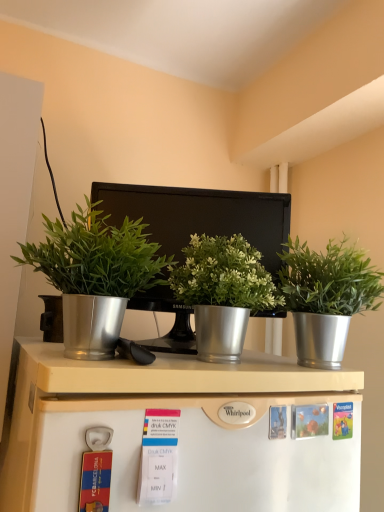
Question: Does point (130, 355) appear closer or farther from the camera than point (182, 305)?

Choices:
 (A) farther
 (B) closer

Answer: (B)

Question: From the image's perspective, relative to metallic silver monitor at center, is metallic silver plant pot at left, positioned as the 1th houseplant in left-to-right order, above or below?

Choices:
 (A) below
 (B) above

Answer: (B)

Question: Estimate the real-world distances between objects in this image. Which object is closer to the silver metallic plant pot at center, which is the 3th houseplant in left-to-right order?

Choices:
 (A) metallic silver pot at center, the second houseplant in the right-to-left sequence
 (B) metallic silver plant pot at left, positioned as the third houseplant in right-to-left order
 (C) white matte refrigerator at lower center
 (D) metallic silver monitor at center

Answer: (A)

Question: Which is farther from the metallic silver pot at center, which is the 2th houseplant from left to right?

Choices:
 (A) metallic silver plant pot at left, positioned as the third houseplant in right-to-left order
 (B) silver metallic plant pot at center, which is the 3th houseplant in left-to-right order
 (C) metallic silver monitor at center
 (D) white matte refrigerator at lower center

Answer: (D)